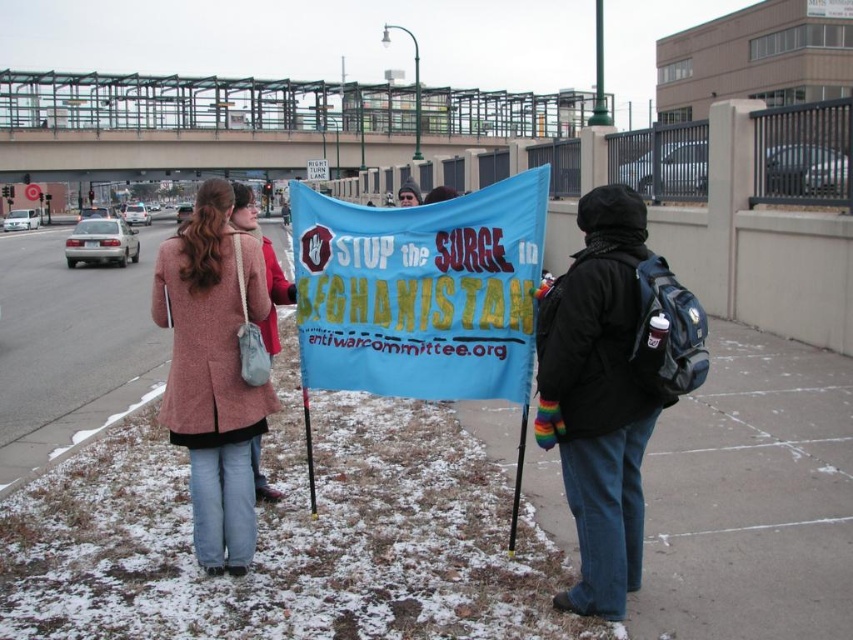
Question: Which of the following is the closest to the observer?

Choices:
 (A) tap(309, 620)
 (B) tap(579, 596)
 (C) tap(387, 372)
 (D) tap(199, 195)

Answer: (B)

Question: From the image, what is the correct spatial relationship of snow-covered concrete at center in relation to rustic wool coat at center?

Choices:
 (A) above
 (B) below

Answer: (A)

Question: Is blue fabric banner at center below rustic wool coat at center?

Choices:
 (A) no
 (B) yes

Answer: (A)

Question: Considering the real-world distances, which object is closest to the blue fabric banner at center?

Choices:
 (A) rustic wool coat at center
 (B) black fleece jacket at center

Answer: (B)

Question: Does snow-covered concrete at center have a larger size compared to black fleece jacket at center?

Choices:
 (A) yes
 (B) no

Answer: (A)

Question: Among these objects, which one is farthest from the camera?

Choices:
 (A) blue fabric banner at center
 (B) snow-covered concrete at center

Answer: (A)